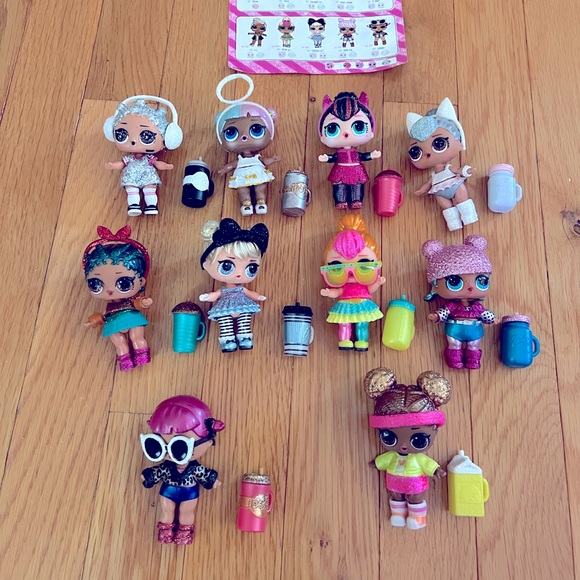
Locate an element on the screen. lines in wooden table is located at coordinates (20, 44), (89, 66), (160, 68), (223, 198), (300, 234), (380, 234), (462, 232), (543, 253).